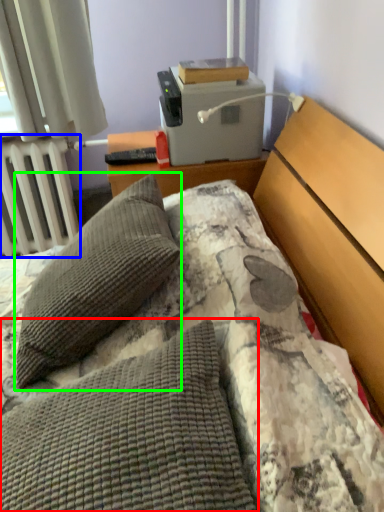
Question: Considering the real-world distances, which object is farthest from pillow (highlighted by a red box)? radiator (highlighted by a blue box) or pillow (highlighted by a green box)?

Choices:
 (A) radiator
 (B) pillow

Answer: (A)